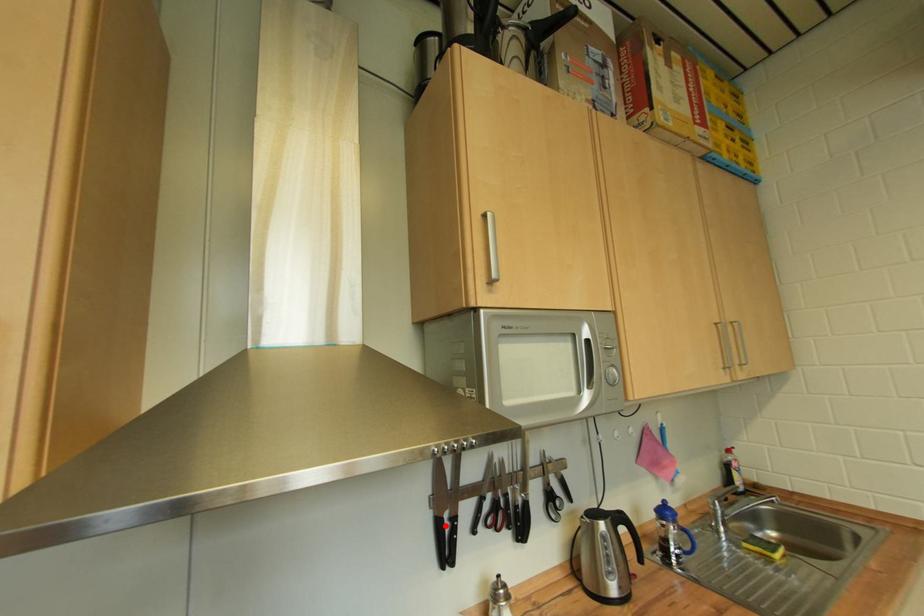
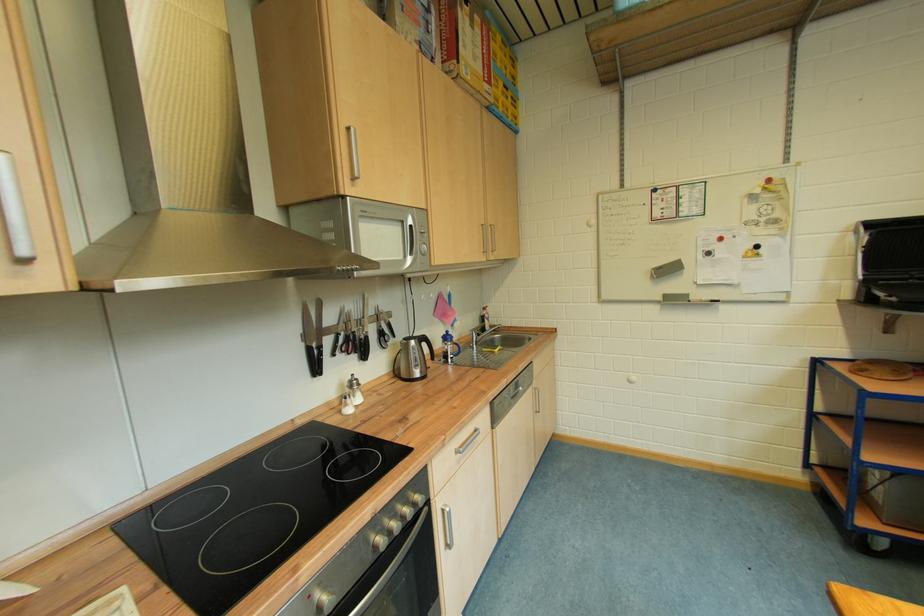
Locate, in the second image, the point that corresponds to the highlighted location in the first image.

(317, 352)